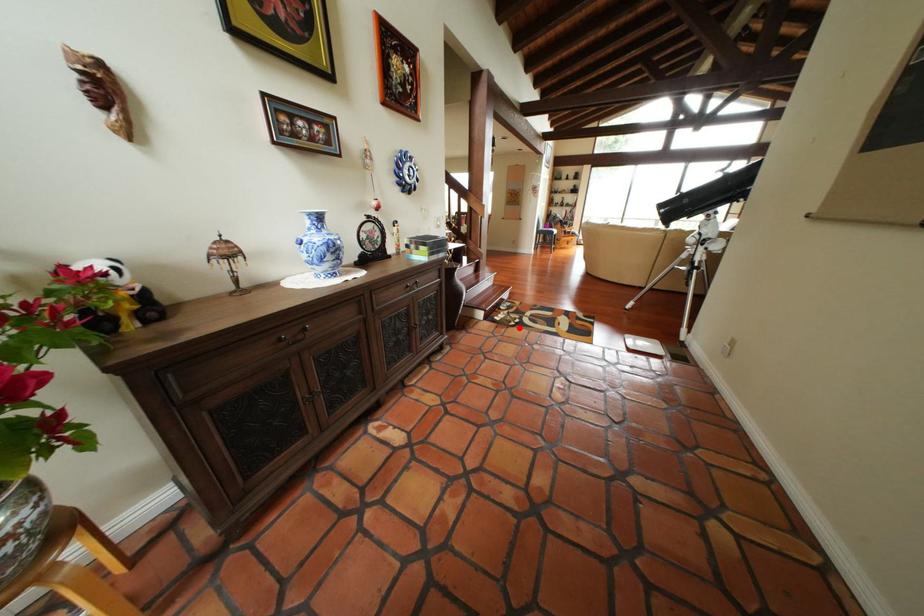
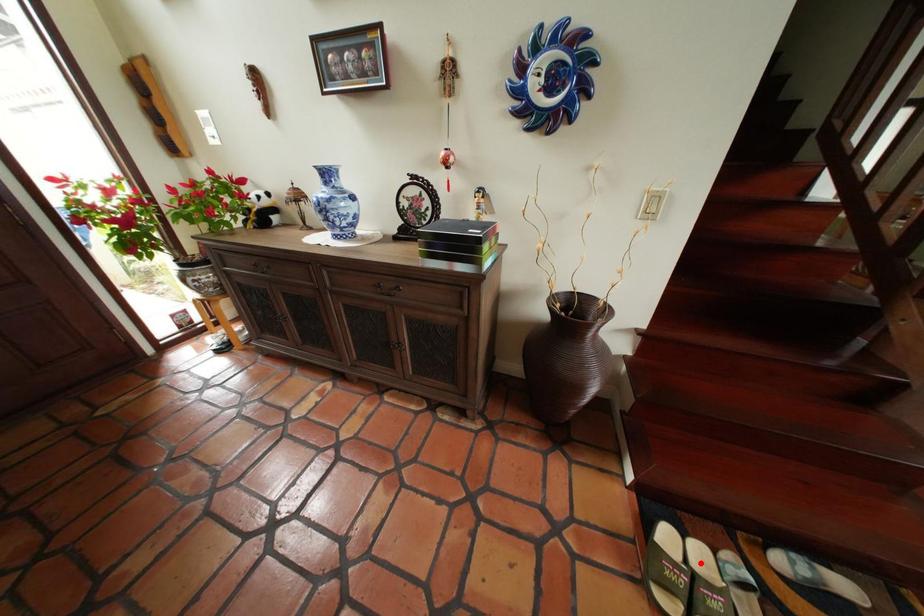
Based on the photo, I am providing you with two images of the same scene from different viewpoints. A red point is marked on the first image and another point is marked on the second image. Are the points marked in image1 and image2 representing the same 3D position?

No